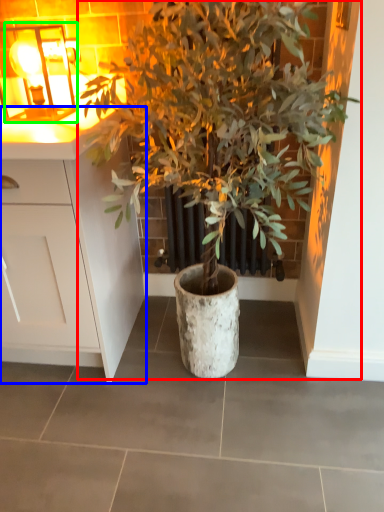
Question: Considering the real-world distances, which object is farthest from houseplant (highlighted by a red box)? cabinetry (highlighted by a blue box) or light fixture (highlighted by a green box)?

Choices:
 (A) cabinetry
 (B) light fixture

Answer: (B)